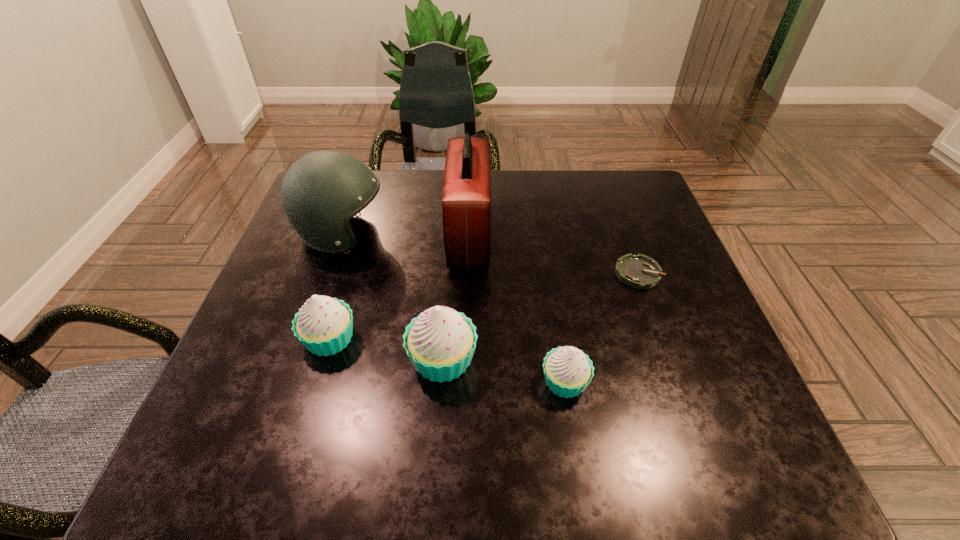
You are a GUI agent. You are given a task and a screenshot of the screen. Output one action in this format:
    pyautogui.click(x=<x>, y=<y>)
    Task: Click on the vacant space located 0.190m on the back of the second shortest cupcake
    The width and height of the screenshot is (960, 540).
    Given the screenshot: What is the action you would take?
    pyautogui.click(x=354, y=256)

This screenshot has width=960, height=540. Find the location of `blank space located on the front of the tallest cupcake`. blank space located on the front of the tallest cupcake is located at coordinates (439, 416).

Where is `vacant space situated 0.070m on the left of the second object from right to left`? vacant space situated 0.070m on the left of the second object from right to left is located at coordinates (503, 381).

This screenshot has width=960, height=540. I want to click on free space located on the side of the first aid kit with the cross symbol, so click(x=593, y=236).

What are the coordinates of `vacant space situated 0.390m on the back of the shortest object` in the screenshot? It's located at (601, 171).

The image size is (960, 540). I want to click on vacant space located at the face opening of the football helmet, so click(x=444, y=234).

Identify the location of the first aid kit that is at the far edge. (466, 201).

Where is `football helmet located in the far edge section of the desktop`? The width and height of the screenshot is (960, 540). football helmet located in the far edge section of the desktop is located at coordinates (320, 193).

Locate an element on the screen. cupcake located in the left edge section of the desktop is located at coordinates (324, 325).

Locate an element on the screen. football helmet that is at the left edge is located at coordinates (320, 193).